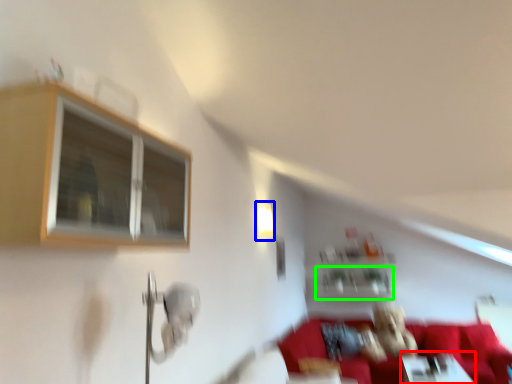
Question: Based on their relative distances, which object is nearer to table (highlighted by a red box)? Choose from light fixture (highlighted by a blue box) and shelf (highlighted by a green box).

Choices:
 (A) light fixture
 (B) shelf

Answer: (B)